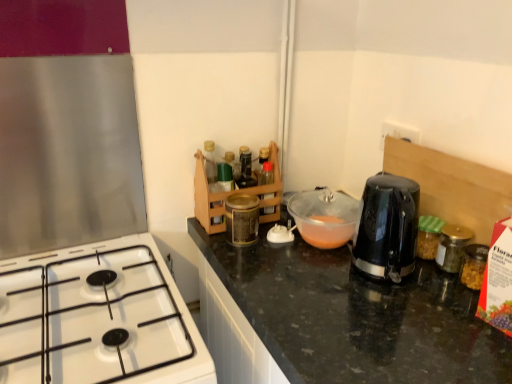
Question: Is white glossy gas stove at lower left at the right side of gold metallic jar at right?

Choices:
 (A) no
 (B) yes

Answer: (A)

Question: Is white glossy gas stove at lower left directly adjacent to gold metallic jar at right?

Choices:
 (A) no
 (B) yes

Answer: (A)

Question: Is white glossy gas stove at lower left wider than gold metallic jar at right?

Choices:
 (A) yes
 (B) no

Answer: (A)

Question: Is white glossy gas stove at lower left outside of gold metallic jar at right?

Choices:
 (A) yes
 (B) no

Answer: (A)

Question: Does white glossy gas stove at lower left have a lesser width compared to gold metallic jar at right?

Choices:
 (A) no
 (B) yes

Answer: (A)

Question: From the image's perspective, is white glossy gas stove at lower left beneath gold metallic jar at right?

Choices:
 (A) no
 (B) yes

Answer: (B)

Question: Considering the relative sizes of gold metallic jar at right and translucent plastic bowl at center in the image provided, is gold metallic jar at right taller than translucent plastic bowl at center?

Choices:
 (A) no
 (B) yes

Answer: (A)

Question: Does gold metallic jar at right turn towards translucent plastic bowl at center?

Choices:
 (A) no
 (B) yes

Answer: (A)

Question: Can you confirm if gold metallic jar at right is shorter than translucent plastic bowl at center?

Choices:
 (A) yes
 (B) no

Answer: (A)

Question: Is gold metallic jar at right directly adjacent to translucent plastic bowl at center?

Choices:
 (A) no
 (B) yes

Answer: (A)

Question: From the image's perspective, does gold metallic jar at right appear lower than translucent plastic bowl at center?

Choices:
 (A) no
 (B) yes

Answer: (B)

Question: Is gold metallic jar at right in front of translucent plastic bowl at center?

Choices:
 (A) yes
 (B) no

Answer: (A)

Question: Is translucent plastic bowl at center positioned before gold metallic jar at right?

Choices:
 (A) yes
 (B) no

Answer: (B)